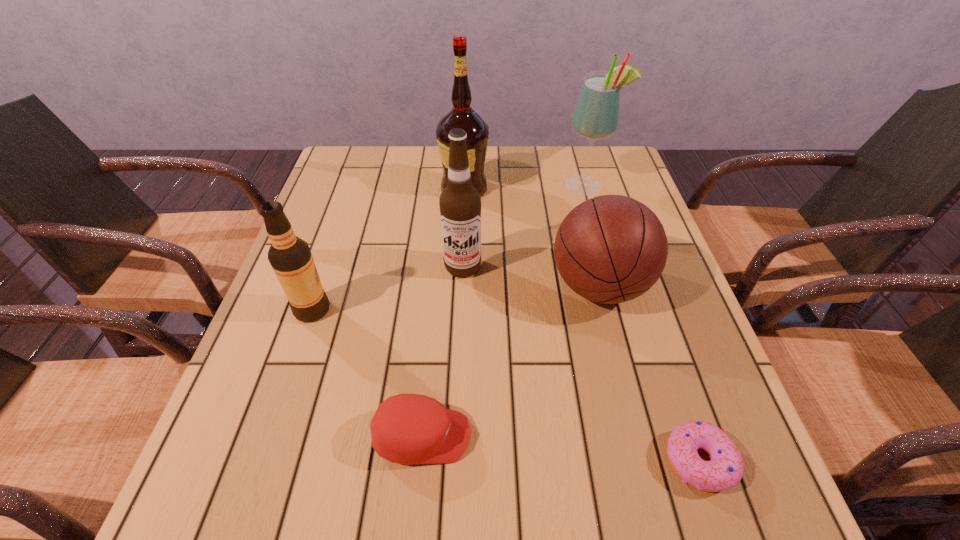
This screenshot has width=960, height=540. Identify the location of blank region between the basketball and the doughnut. (649, 374).

The image size is (960, 540). I want to click on vacant space that's between the doughnut and the second nearest alcohol, so click(x=581, y=364).

Point out which object is positioned as the sixth nearest to the second nearest alcohol. Please provide its 2D coordinates. Your answer should be formatted as a tuple, i.e. [(x, y)], where the tuple contains the x and y coordinates of a point satisfying the conditions above.

[(725, 469)]

Select which object is the fifth closest to the nearest alcohol. Please provide its 2D coordinates. Your answer should be formatted as a tuple, i.e. [(x, y)], where the tuple contains the x and y coordinates of a point satisfying the conditions above.

[(596, 115)]

The height and width of the screenshot is (540, 960). In order to click on alcohol object that ranks as the fourth closest to the basketball in this screenshot , I will do `click(290, 257)`.

Where is `alcohol that is the fourth nearest to the basketball`? alcohol that is the fourth nearest to the basketball is located at coordinates (290, 257).

At what (x,y) coordinates should I click in order to perform the action: click on vacant area that satisfies the following two spatial constraints: 1. on the front side of the basketball; 2. on the right side of the shortest object. Please return your answer as a coordinate pair (x, y). This screenshot has width=960, height=540. Looking at the image, I should click on (643, 461).

Find the location of a particular element. Image resolution: width=960 pixels, height=540 pixels. vacant space that satisfies the following two spatial constraints: 1. on the label of the second nearest alcohol; 2. on the label of the fourth tallest object is located at coordinates (461, 309).

Locate an element on the screen. The height and width of the screenshot is (540, 960). free location that satisfies the following two spatial constraints: 1. on the front-facing side of the cap; 2. on the right side of the shortest object is located at coordinates (420, 461).

Locate an element on the screen. This screenshot has width=960, height=540. vacant space that satisfies the following two spatial constraints: 1. on the label of the shortest alcohol; 2. on the right side of the shortest object is located at coordinates (260, 461).